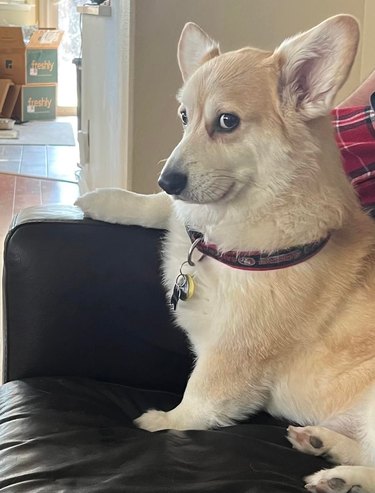
Where is `cardboard box`? The image size is (375, 493). cardboard box is located at coordinates (43, 63), (39, 97).